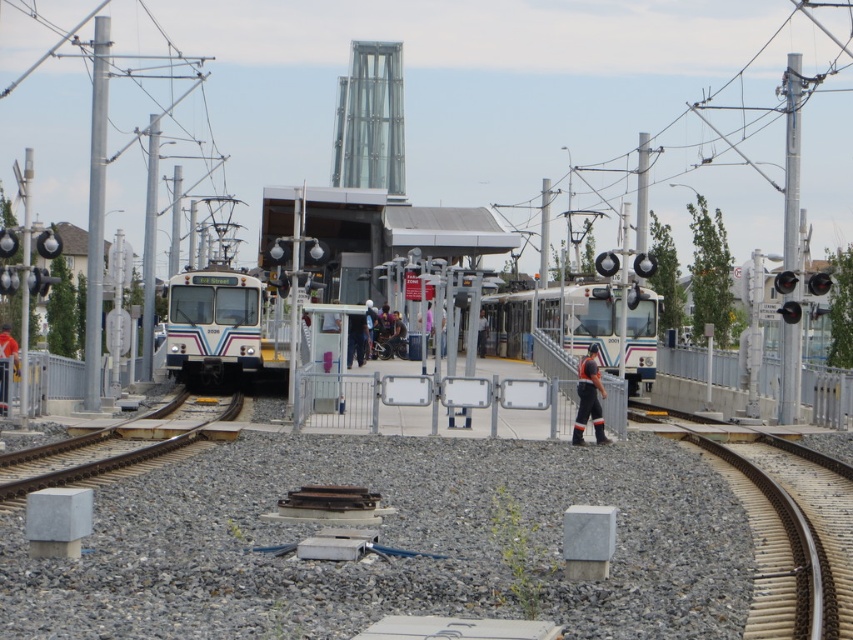
Question: Which point is closer to the camera?

Choices:
 (A) (223, 292)
 (B) (3, 410)
 (C) (207, 438)

Answer: (C)

Question: Does white glossy passenger train at center have a greater width compared to orange reflective pants at center?

Choices:
 (A) yes
 (B) no

Answer: (A)

Question: Is white glossy train at center closer to camera compared to white shirt at center?

Choices:
 (A) yes
 (B) no

Answer: (A)

Question: Which object is farther from the camera taking this photo?

Choices:
 (A) white shirt at center
 (B) white glossy train at center
 (C) gray gravel train track at lower left
 (D) brown wooden train track at lower right

Answer: (A)

Question: Does brown wooden train track at lower right appear under white glossy train at center?

Choices:
 (A) no
 (B) yes

Answer: (B)

Question: Which of the following is the closest to the observer?

Choices:
 (A) (599, 300)
 (B) (780, 518)
 (C) (85, 435)

Answer: (B)